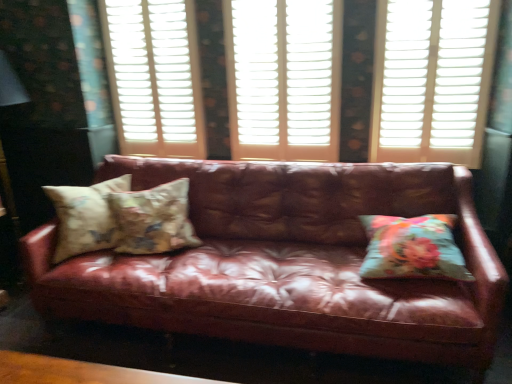
Measure the distance between point (160, 28) and camera.

The depth of point (160, 28) is 2.76 meters.

The height and width of the screenshot is (384, 512). Describe the element at coordinates (154, 76) in the screenshot. I see `white plastic shutters at center, acting as the 1th window frame starting from the left` at that location.

The image size is (512, 384). Describe the element at coordinates (432, 79) in the screenshot. I see `white plastic shutters at upper center` at that location.

The image size is (512, 384). In order to click on floral fabric cushion at center, the 3th pillow positioned from the right in this screenshot , I will do `click(85, 217)`.

This screenshot has height=384, width=512. What do you see at coordinates (153, 219) in the screenshot?
I see `floral fabric pillow at center, the 2th pillow when ordered from right to left` at bounding box center [153, 219].

Find the location of a particular element. This screenshot has height=384, width=512. white plastic shutters at center, which ranks as the 2th window frame in right-to-left order is located at coordinates coord(154,76).

The width and height of the screenshot is (512, 384). I want to click on pillow below the floral fabric pillow at right, which ranks as the first pillow in right-to-left order (from a real-world perspective), so click(85, 217).

Can you tell me how much floral fabric pillow at right, the third pillow in the left-to-right sequence, and floral fabric cushion at center, the 3th pillow positioned from the right, differ in facing direction?

floral fabric pillow at right, the third pillow in the left-to-right sequence, and floral fabric cushion at center, the 3th pillow positioned from the right, are facing 45.9 degrees away from each other.

Which is behind, floral fabric pillow at right, the third pillow in the left-to-right sequence, or floral fabric cushion at center, the 3th pillow positioned from the right?

floral fabric cushion at center, the 3th pillow positioned from the right, is behind.

Considering the sizes of objects floral fabric pillow at right, the third pillow in the left-to-right sequence, and floral fabric cushion at center, the 3th pillow positioned from the right, in the image provided, who is taller, floral fabric pillow at right, the third pillow in the left-to-right sequence, or floral fabric cushion at center, the 3th pillow positioned from the right,?

floral fabric cushion at center, the 3th pillow positioned from the right.

Can you tell me how much floral fabric cushion at center, which ranks as the 1th pillow in left-to-right order, and leather couch at center differ in facing direction?

The angular difference between floral fabric cushion at center, which ranks as the 1th pillow in left-to-right order, and leather couch at center is 45.8 degrees.

Considering the positions of point (55, 203) and point (53, 273), is point (55, 203) closer or farther from the camera than point (53, 273)?

Point (55, 203) is farther from the camera than point (53, 273).

From the image's perspective, is floral fabric cushion at center, the 3th pillow positioned from the right, over leather couch at center?

Correct, floral fabric cushion at center, the 3th pillow positioned from the right, appears higher than leather couch at center in the image.

In the scene shown: From a real-world perspective, is floral fabric cushion at center, which ranks as the 1th pillow in left-to-right order, physically located above or below leather couch at center?

Clearly, from a real-world perspective, floral fabric cushion at center, which ranks as the 1th pillow in left-to-right order, is above leather couch at center.

Considering the relative sizes of white wood window frame at center, the 2th window frame viewed from the left, and white plastic shutters at upper center in the image provided, is white wood window frame at center, the 2th window frame viewed from the left, bigger than white plastic shutters at upper center?

Yes, white wood window frame at center, the 2th window frame viewed from the left, is bigger than white plastic shutters at upper center.

Consider the image. From the image's perspective, would you say white wood window frame at center, which ranks as the first window frame in right-to-left order, is shown under white plastic shutters at upper center?

Incorrect, from the image's perspective, white wood window frame at center, which ranks as the first window frame in right-to-left order, is higher than white plastic shutters at upper center.

You are a GUI agent. You are given a task and a screenshot of the screen. Output one action in this format:
    pyautogui.click(x=<x>, y=<y>)
    Task: Click on the window below the white wood window frame at center, which ranks as the first window frame in right-to-left order (from the image's perspective)
    The image size is (512, 384).
    Given the screenshot: What is the action you would take?
    pyautogui.click(x=432, y=79)

Is white wood window frame at center, the 2th window frame viewed from the left, turned away from white plastic shutters at upper center?

white wood window frame at center, the 2th window frame viewed from the left, does not have its back to white plastic shutters at upper center.

Which point is more forward, (144, 204) or (413, 246)?

Positioned in front is point (413, 246).

From the image's perspective, which one is positioned lower, floral fabric pillow at center, placed as the 2th pillow when sorted from left to right, or floral fabric pillow at right, which ranks as the first pillow in right-to-left order?

floral fabric pillow at right, which ranks as the first pillow in right-to-left order.

Based on their sizes in the image, would you say floral fabric pillow at center, placed as the 2th pillow when sorted from left to right, is bigger or smaller than floral fabric pillow at right, which ranks as the first pillow in right-to-left order?

In the image, floral fabric pillow at center, placed as the 2th pillow when sorted from left to right, appears to be larger than floral fabric pillow at right, which ranks as the first pillow in right-to-left order.

Image resolution: width=512 pixels, height=384 pixels. In order to click on the 2nd pillow in front when counting from the floral fabric pillow at center, the 2th pillow when ordered from right to left in this screenshot , I will do `click(412, 248)`.

How many degrees apart are the facing directions of white plastic shutters at upper center and white plastic shutters at center, which ranks as the 2th window frame in right-to-left order?

They differ by 2.49 degrees in their facing directions.

Image resolution: width=512 pixels, height=384 pixels. I want to click on the 2nd window frame behind the white plastic shutters at upper center, so click(x=154, y=76).

Considering the positions of objects white plastic shutters at upper center and white plastic shutters at center, which ranks as the 2th window frame in right-to-left order, in the image provided, who is more to the right, white plastic shutters at upper center or white plastic shutters at center, which ranks as the 2th window frame in right-to-left order,?

white plastic shutters at upper center is more to the right.

Is leather couch at center not within floral fabric pillow at right, which ranks as the first pillow in right-to-left order?

Indeed, leather couch at center is completely outside floral fabric pillow at right, which ranks as the first pillow in right-to-left order.

Consider the image. Can you tell me how much leather couch at center and floral fabric pillow at right, the third pillow in the left-to-right sequence, differ in facing direction?

leather couch at center and floral fabric pillow at right, the third pillow in the left-to-right sequence, are facing 0.0282 degrees away from each other.

Considering the relative sizes of leather couch at center and floral fabric pillow at right, the third pillow in the left-to-right sequence, in the image provided, is leather couch at center bigger than floral fabric pillow at right, the third pillow in the left-to-right sequence,?

Correct, leather couch at center is larger in size than floral fabric pillow at right, the third pillow in the left-to-right sequence.

Based on the photo, from the image's perspective, which one is positioned lower, leather couch at center or floral fabric pillow at right, the third pillow in the left-to-right sequence?

From the image's view, leather couch at center is below.

Between white plastic shutters at upper center and leather couch at center, which one is positioned behind?

white plastic shutters at upper center is further away from the camera.

In the image, there is a white plastic shutters at upper center. Identify the location of studio couch below it (from a real-world perspective). The image size is (512, 384). pyautogui.click(x=287, y=263).

The image size is (512, 384). Find the location of `the 1st pillow behind the floral fabric pillow at right, which ranks as the first pillow in right-to-left order`. the 1st pillow behind the floral fabric pillow at right, which ranks as the first pillow in right-to-left order is located at coordinates (85, 217).

You are a GUI agent. You are given a task and a screenshot of the screen. Output one action in this format:
    pyautogui.click(x=<x>, y=<y>)
    Task: Click on the studio couch below the floral fabric cushion at center, the 3th pillow positioned from the right (from a real-world perspective)
    
    Given the screenshot: What is the action you would take?
    pyautogui.click(x=287, y=263)

Based on their spatial positions, is floral fabric pillow at right, the third pillow in the left-to-right sequence, or white plastic shutters at center, acting as the 1th window frame starting from the left, further from white wood window frame at center, the 2th window frame viewed from the left?

floral fabric pillow at right, the third pillow in the left-to-right sequence, is positioned further to the anchor white wood window frame at center, the 2th window frame viewed from the left.

Based on their spatial positions, is white wood window frame at center, which ranks as the first window frame in right-to-left order, or leather couch at center closer to white plastic shutters at center, which ranks as the 2th window frame in right-to-left order?

white wood window frame at center, which ranks as the first window frame in right-to-left order.

Looking at the image, which one is located closer to floral fabric pillow at center, the 2th pillow when ordered from right to left, white wood window frame at center, the 2th window frame viewed from the left, or leather couch at center?

The object closer to floral fabric pillow at center, the 2th pillow when ordered from right to left, is leather couch at center.

Looking at the image, which one is located closer to white wood window frame at center, the 2th window frame viewed from the left, floral fabric cushion at center, the 3th pillow positioned from the right, or white plastic shutters at upper center?

The object closer to white wood window frame at center, the 2th window frame viewed from the left, is white plastic shutters at upper center.

When comparing their distances from white plastic shutters at center, acting as the 1th window frame starting from the left, does floral fabric cushion at center, the 3th pillow positioned from the right, or leather couch at center seem closer?

The object closer to white plastic shutters at center, acting as the 1th window frame starting from the left, is floral fabric cushion at center, the 3th pillow positioned from the right.

Based on their spatial positions, is leather couch at center or white plastic shutters at center, which ranks as the 2th window frame in right-to-left order, further from floral fabric pillow at right, the third pillow in the left-to-right sequence?

white plastic shutters at center, which ranks as the 2th window frame in right-to-left order, is positioned further to the anchor floral fabric pillow at right, the third pillow in the left-to-right sequence.

From the image, which object appears to be nearer to leather couch at center, white plastic shutters at center, acting as the 1th window frame starting from the left, or white wood window frame at center, which ranks as the first window frame in right-to-left order?

Based on the image, white wood window frame at center, which ranks as the first window frame in right-to-left order, appears to be nearer to leather couch at center.

Estimate the real-world distances between objects in this image. Which object is further from leather couch at center, white wood window frame at center, the 2th window frame viewed from the left, or floral fabric cushion at center, which ranks as the 1th pillow in left-to-right order?

Based on the image, white wood window frame at center, the 2th window frame viewed from the left, appears to be further to leather couch at center.

Where is `studio couch between white plastic shutters at center, acting as the 1th window frame starting from the left, and floral fabric pillow at right, the third pillow in the left-to-right sequence, from left to right`? studio couch between white plastic shutters at center, acting as the 1th window frame starting from the left, and floral fabric pillow at right, the third pillow in the left-to-right sequence, from left to right is located at coordinates (287, 263).

This screenshot has height=384, width=512. Find the location of `pillow between white plastic shutters at center, which ranks as the 2th window frame in right-to-left order, and floral fabric pillow at right, which ranks as the first pillow in right-to-left order`. pillow between white plastic shutters at center, which ranks as the 2th window frame in right-to-left order, and floral fabric pillow at right, which ranks as the first pillow in right-to-left order is located at coordinates point(153,219).

You are a GUI agent. You are given a task and a screenshot of the screen. Output one action in this format:
    pyautogui.click(x=<x>, y=<y>)
    Task: Click on the pillow located between floral fabric cushion at center, which ranks as the 1th pillow in left-to-right order, and floral fabric pillow at right, which ranks as the first pillow in right-to-left order, in the left-right direction
    This screenshot has height=384, width=512.
    Given the screenshot: What is the action you would take?
    pyautogui.click(x=153, y=219)

At what (x,y) coordinates should I click in order to perform the action: click on studio couch between white plastic shutters at center, which ranks as the 2th window frame in right-to-left order, and white plastic shutters at upper center, in the horizontal direction. Please return your answer as a coordinate pair (x, y). Image resolution: width=512 pixels, height=384 pixels. Looking at the image, I should click on (287, 263).